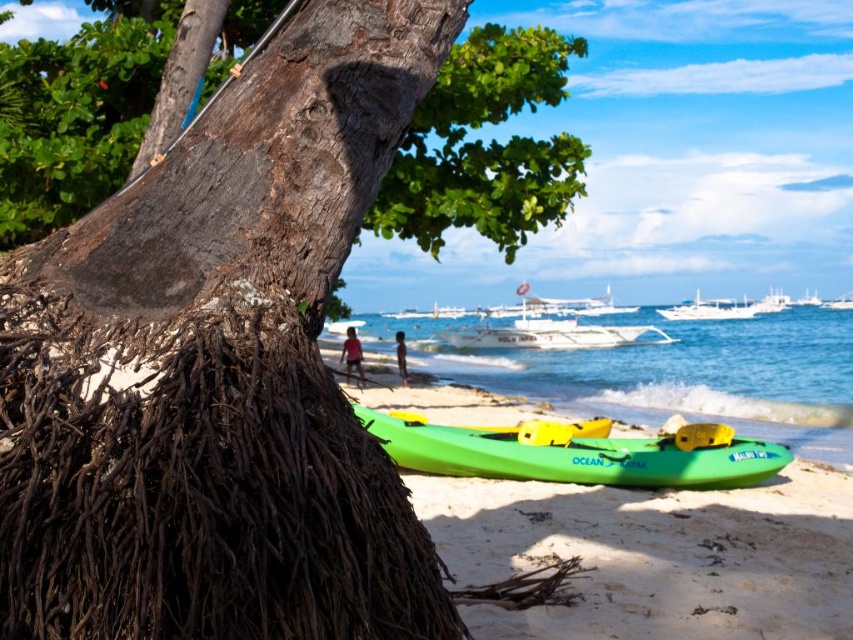
Who is lower down, transparent blue water at center or green plastic kayak at lower center?

green plastic kayak at lower center is below.

Which of these two, transparent blue water at center or green plastic kayak at lower center, stands shorter?

With less height is green plastic kayak at lower center.

Find the location of `transparent blue water at center`. transparent blue water at center is located at coordinates click(x=668, y=369).

The image size is (853, 640). I want to click on transparent blue water at center, so click(668, 369).

Does point (288, 566) lie in front of point (729, 314)?

Yes, point (288, 566) is in front of point (729, 314).

Does brown rough bark tree at center appear on the right side of white glossy boat at upper center?

In fact, brown rough bark tree at center is to the left of white glossy boat at upper center.

Who is more distant from viewer, (38, 513) or (698, 308)?

Positioned behind is point (698, 308).

Identify the location of brown rough bark tree at center. (221, 368).

Is brown rough bark tree at center shorter than green plastic kayak at center?

No, brown rough bark tree at center is not shorter than green plastic kayak at center.

You are a GUI agent. You are given a task and a screenshot of the screen. Output one action in this format:
    pyautogui.click(x=<x>, y=<y>)
    Task: Click on the brown rough bark tree at center
    The width and height of the screenshot is (853, 640).
    Given the screenshot: What is the action you would take?
    pyautogui.click(x=221, y=368)

Is point (200, 305) positioned before point (328, 360)?

Yes, point (200, 305) is in front of point (328, 360).

You are a GUI agent. You are given a task and a screenshot of the screen. Output one action in this format:
    pyautogui.click(x=<x>, y=<y>)
    Task: Click on the brown rough bark tree at center
    This screenshot has height=640, width=853.
    Given the screenshot: What is the action you would take?
    pyautogui.click(x=221, y=368)